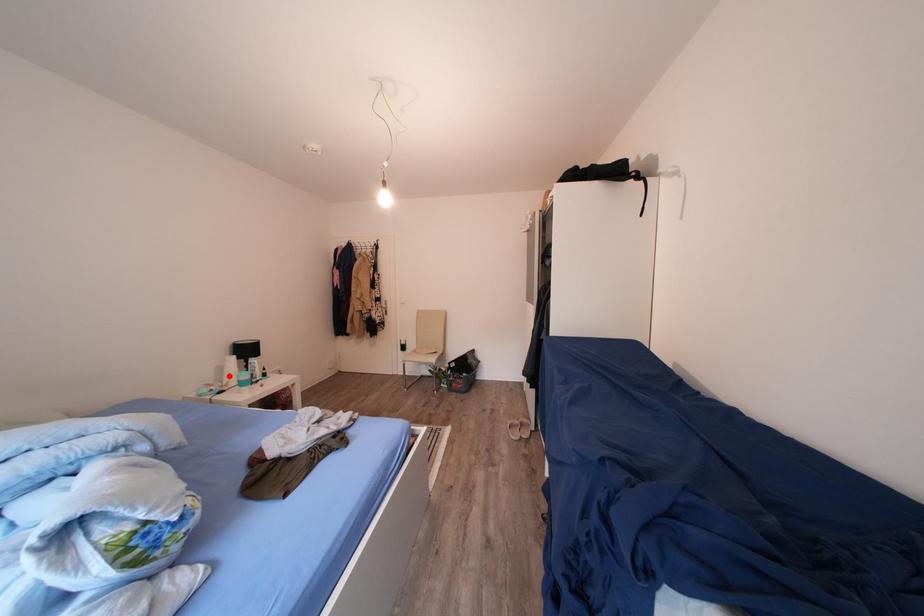
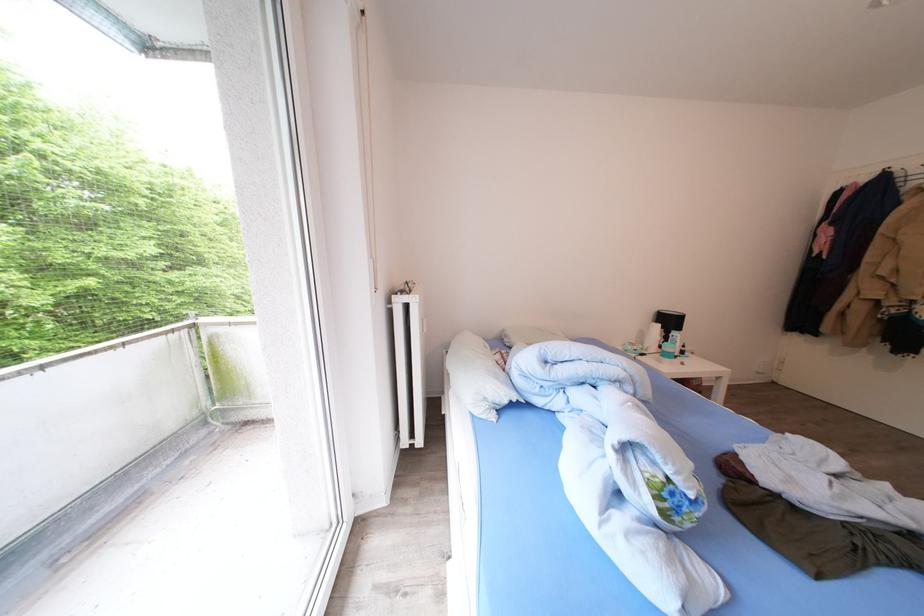
Locate, in the second image, the point that corresponds to the highlighted location in the first image.

(650, 339)